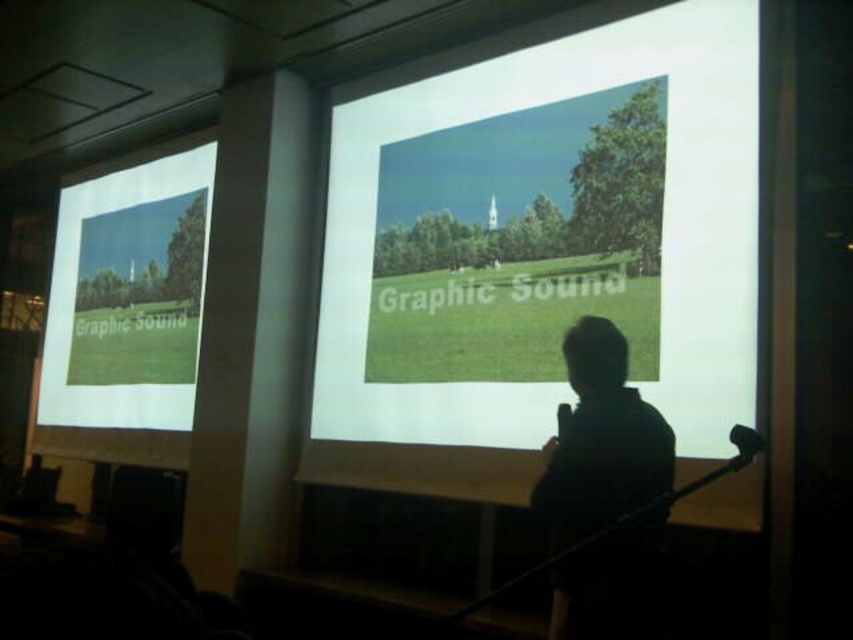
The height and width of the screenshot is (640, 853). Describe the element at coordinates (538, 257) in the screenshot. I see `green grassy field at center` at that location.

How distant is green grassy field at center from silhouette human at center?

They are 37.87 inches apart.

Who is more distant from viewer, (747, 77) or (602, 388)?

The point (747, 77) is behind.

Locate an element on the screen. green grassy field at center is located at coordinates (538, 257).

Can you confirm if matte white screen at left is positioned above silhouette human at center?

Yes.

Is point (164, 454) positioned behind point (541, 484)?

Yes, point (164, 454) is behind point (541, 484).

At what (x,y) coordinates should I click in order to perform the action: click on matte white screen at left. Please return your answer as a coordinate pair (x, y). Looking at the image, I should click on (125, 316).

Is green grassy field at center thinner than matte white screen at left?

No.

Who is shorter, green grassy field at center or matte white screen at left?

With less height is matte white screen at left.

Is point (396, 102) positioned behind point (171, 170)?

No, (396, 102) is in front of (171, 170).

Locate an element on the screen. This screenshot has width=853, height=640. green grassy field at center is located at coordinates (538, 257).